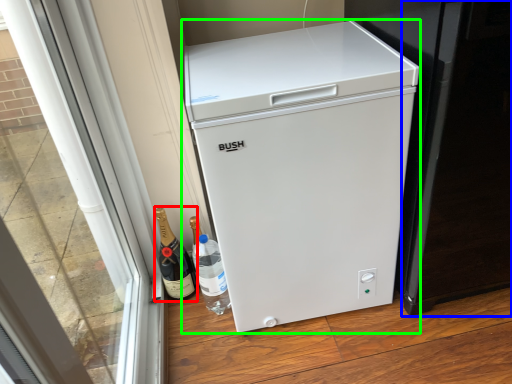
Question: Which is nearer to the wine (highlighted by a red box)? screen door (highlighted by a blue box) or refrigerator (highlighted by a green box).

Choices:
 (A) screen door
 (B) refrigerator

Answer: (B)